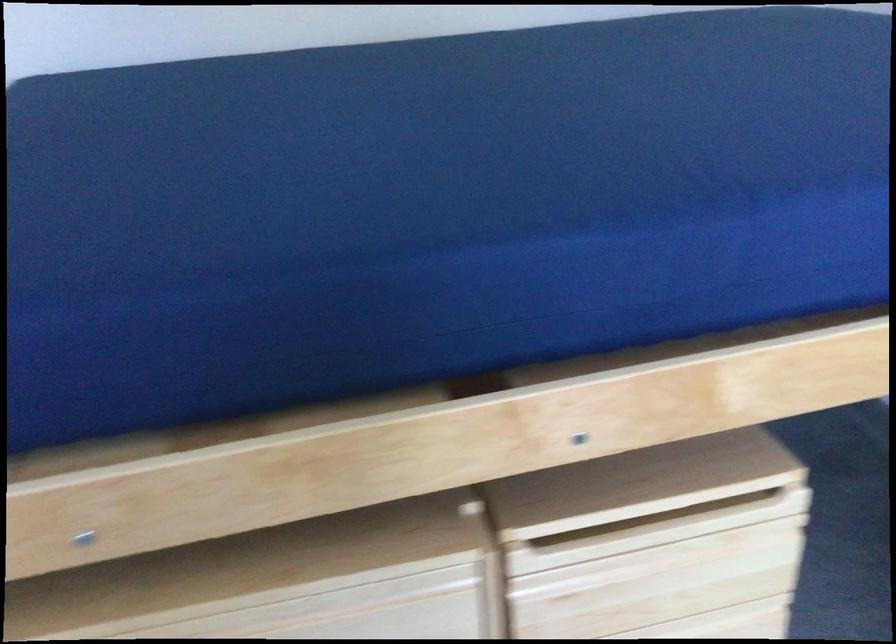
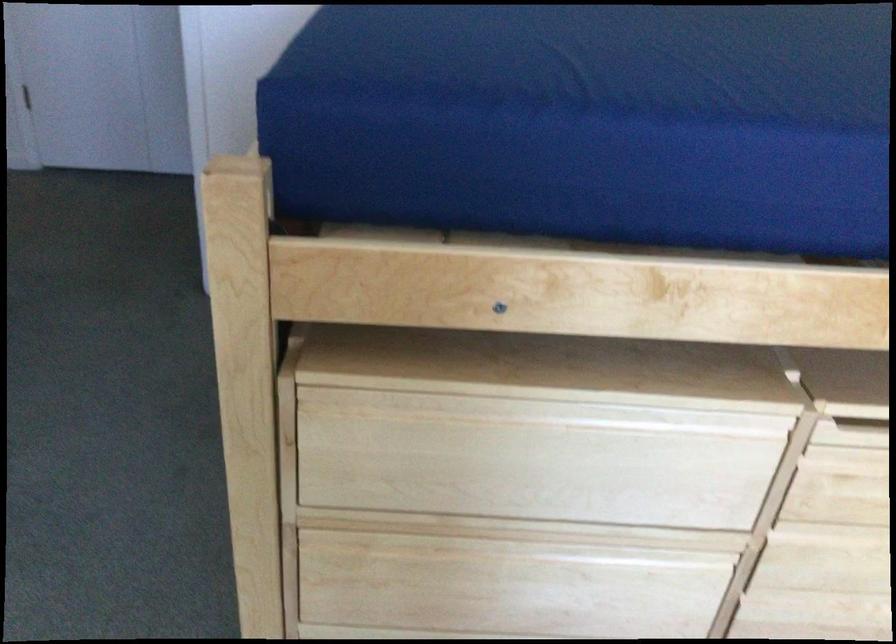
In a continuous first-person perspective shot, in which direction is the camera moving?

The movement direction of the cameraman is left, backward.